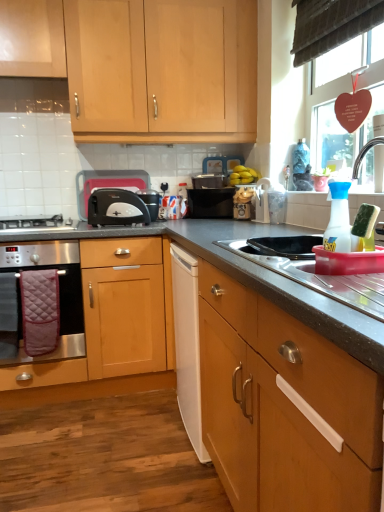
What is the approximate height of yellow matte bananas at upper center?

The height of yellow matte bananas at upper center is 4.70 inches.

Describe the element at coordinates (320, 279) in the screenshot. The height and width of the screenshot is (512, 384). I see `stainless steel sink at lower right` at that location.

Describe the element at coordinates (40, 310) in the screenshot. The height and width of the screenshot is (512, 384). I see `pink quilted oven mitt at lower left` at that location.

You are a GUI agent. You are given a task and a screenshot of the screen. Output one action in this format:
    pyautogui.click(x=<x>, y=<y>)
    Task: Click on the white plastic sponge at right, marked as the first appliance in a front-to-back arrangement
    The height and width of the screenshot is (512, 384).
    Given the screenshot: What is the action you would take?
    pyautogui.click(x=364, y=228)

Are silver metallic faucet at upper right and light wood/finish cabinet at upper left, which is counted as the first cabinetry, starting from the back, located far from each other?

Yes, silver metallic faucet at upper right and light wood/finish cabinet at upper left, which is counted as the first cabinetry, starting from the back, are quite far apart.

Measure the distance from silver metallic faucet at upper right to light wood/finish cabinet at upper left, which is counted as the first cabinetry, starting from the back.

A distance of 3.98 feet exists between silver metallic faucet at upper right and light wood/finish cabinet at upper left, which is counted as the first cabinetry, starting from the back.

Does silver metallic faucet at upper right have a greater width compared to light wood/finish cabinet at upper left, which is counted as the first cabinetry, starting from the back?

In fact, silver metallic faucet at upper right might be narrower than light wood/finish cabinet at upper left, which is counted as the first cabinetry, starting from the back.

From the image's perspective, is silver metallic faucet at upper right beneath light wood/finish cabinet at upper left, placed as the 1th cabinetry when sorted from top to bottom?

Indeed, from the image's perspective, silver metallic faucet at upper right is shown beneath light wood/finish cabinet at upper left, placed as the 1th cabinetry when sorted from top to bottom.

Considering the relative sizes of white plastic container at upper center, the 3th appliance positioned from the front, and pink quilted oven mitt at lower left in the image provided, is white plastic container at upper center, the 3th appliance positioned from the front, thinner than pink quilted oven mitt at lower left?

No.

Which is correct: white plastic container at upper center, arranged as the third appliance when viewed from the back, is inside pink quilted oven mitt at lower left, or outside of it?

white plastic container at upper center, arranged as the third appliance when viewed from the back, exists outside the volume of pink quilted oven mitt at lower left.

Is white plastic container at upper center, arranged as the third appliance when viewed from the back, positioned with its back to pink quilted oven mitt at lower left?

No, white plastic container at upper center, arranged as the third appliance when viewed from the back,'s orientation is not away from pink quilted oven mitt at lower left.

Is dark gray laminate countertop at center not within transparent plastic spray bottle at right, placed as the 2th appliance when sorted from front to back?

Absolutely, dark gray laminate countertop at center is external to transparent plastic spray bottle at right, placed as the 2th appliance when sorted from front to back.

Which object is positioned more to the right, dark gray laminate countertop at center or transparent plastic spray bottle at right, placed as the 2th appliance when sorted from front to back?

From the viewer's perspective, transparent plastic spray bottle at right, placed as the 2th appliance when sorted from front to back, appears more on the right side.

Can you confirm if dark gray laminate countertop at center is smaller than transparent plastic spray bottle at right, placed as the 2th appliance when sorted from front to back?

No, dark gray laminate countertop at center is not smaller than transparent plastic spray bottle at right, placed as the 2th appliance when sorted from front to back.

From a real-world perspective, is dark gray laminate countertop at center under transparent plastic spray bottle at right, placed as the 2th appliance when sorted from front to back?

Yes.

Is white plastic toaster at center-left not within stainless steel sink at lower right?

Absolutely, white plastic toaster at center-left is external to stainless steel sink at lower right.

Considering the sizes of objects white plastic toaster at center-left and stainless steel sink at lower right in the image provided, who is shorter, white plastic toaster at center-left or stainless steel sink at lower right?

stainless steel sink at lower right is shorter.

Between white plastic toaster at center-left and stainless steel sink at lower right, which one has smaller width?

white plastic toaster at center-left.

Is point (102, 179) closer or farther from the camera than point (377, 285)?

Point (102, 179) appears to be farther away from the viewer than point (377, 285).

From a real-world perspective, between white plastic container at upper center, arranged as the third appliance when viewed from the back, and white plastic toaster at center-left, who is vertically lower?

From a 3D spatial view, white plastic container at upper center, arranged as the third appliance when viewed from the back, is below.

Based on the photo, can you confirm if white plastic container at upper center, arranged as the third appliance when viewed from the back, is positioned to the left of white plastic toaster at center-left?

No.

Is white plastic container at upper center, the 3th appliance positioned from the front, not within white plastic toaster at center-left?

Yes, white plastic container at upper center, the 3th appliance positioned from the front, is located beyond the bounds of white plastic toaster at center-left.

Between white plastic container at upper center, arranged as the third appliance when viewed from the back, and white plastic toaster at center-left, which one is positioned behind?

Positioned behind is white plastic toaster at center-left.

Based on their positions, is satin silver gas stove at lower left located to the left or right of stainless steel oven at lower left?

Clearly, satin silver gas stove at lower left is on the right of stainless steel oven at lower left in the image.

In terms of height, does satin silver gas stove at lower left look taller or shorter compared to stainless steel oven at lower left?

Considering their sizes, satin silver gas stove at lower left has less height than stainless steel oven at lower left.

Is point (74, 225) less distant than point (47, 260)?

No, (74, 225) is further to viewer.

From a real-world perspective, is satin silver gas stove at lower left physically located above or below stainless steel oven at lower left?

In terms of real-world spatial position, satin silver gas stove at lower left is above stainless steel oven at lower left.

Locate an element on the screen. This screenshot has width=384, height=512. material below the silver metallic faucet at upper right (from the image's perspective) is located at coordinates (40, 310).

From a real-world perspective, does pink quilted oven mitt at lower left stand above silver metallic faucet at upper right?

No, from a real-world perspective, pink quilted oven mitt at lower left is not on top of silver metallic faucet at upper right.

Which object is wider, pink quilted oven mitt at lower left or silver metallic faucet at upper right?

silver metallic faucet at upper right is wider.

Identify the location of cabinetry behind the silver metallic faucet at upper right. This screenshot has width=384, height=512. (142, 64).

You are a GUI agent. You are given a task and a screenshot of the screen. Output one action in this format:
    pyautogui.click(x=<x>, y=<y>)
    Task: Click on the material located below the white plastic container at upper center, arranged as the third appliance when viewed from the back (from the image's perspective)
    This screenshot has width=384, height=512.
    Given the screenshot: What is the action you would take?
    [x=40, y=310]

From the image, which object appears to be nearer to brown fabric exhaust hood at upper center, light wood/finish cabinet at upper left, which is counted as the first cabinetry, starting from the back, or white plastic sponge at right, which ranks as the fifth appliance in back-to-front order?

The object closer to brown fabric exhaust hood at upper center is light wood/finish cabinet at upper left, which is counted as the first cabinetry, starting from the back.

Which object lies nearer to the anchor point pink quilted oven mitt at lower left, yellow matte bananas at upper center or white plastic sponge at right, which ranks as the fifth appliance in back-to-front order?

yellow matte bananas at upper center lies closer to pink quilted oven mitt at lower left than the other object.

When comparing their distances from wooden cabinet at lower right, which appears as the first cabinetry when viewed from the front, does dark gray laminate countertop at center or matte plastic jar at center, marked as the fourth appliance in a front-to-back arrangement, seem closer?

dark gray laminate countertop at center.

Looking at the image, which one is located further to white plastic toaster at center-left, stainless steel oven at lower left or dark gray laminate countertop at center?

The object further to white plastic toaster at center-left is dark gray laminate countertop at center.

From the image, which object appears to be farther from matte plastic jar at center, arranged as the 2th appliance when viewed from the back, light wood/finish cabinet at upper left, the 2th cabinetry when ordered from bottom to top, or white plastic toaster at center-left?

light wood/finish cabinet at upper left, the 2th cabinetry when ordered from bottom to top.

When comparing their distances from pink quilted oven mitt at lower left, does stainless steel oven at lower left or silver metallic faucet at upper right seem closer?

stainless steel oven at lower left is positioned closer to the anchor pink quilted oven mitt at lower left.

Estimate the real-world distances between objects in this image. Which object is closer to transparent plastic spray bottle at right, the 4th appliance in the back-to-front sequence, wooden cabinet at lower right, the second cabinetry positioned from the top, or pink quilted oven mitt at lower left?

Based on the image, wooden cabinet at lower right, the second cabinetry positioned from the top, appears to be nearer to transparent plastic spray bottle at right, the 4th appliance in the back-to-front sequence.

Estimate the real-world distances between objects in this image. Which object is further from satin silver gas stove at lower left, matte plastic jar at center, arranged as the 2th appliance when viewed from the back, or brown fabric exhaust hood at upper center?

The object further to satin silver gas stove at lower left is brown fabric exhaust hood at upper center.

The width and height of the screenshot is (384, 512). I want to click on gas stove between stainless steel sink at lower right and matte plastic jar at center, marked as the fourth appliance in a front-to-back arrangement, along the z-axis, so click(37, 222).

Locate an element on the screen. Image resolution: width=384 pixels, height=512 pixels. material between stainless steel oven at lower left and white plastic container at upper center, the 3th appliance positioned from the front is located at coordinates (40, 310).

Identify the location of home appliance positioned between wooden cabinet at lower right, the 2th cabinetry viewed from the back, and satin silver gas stove at lower left from near to far. pyautogui.click(x=59, y=297).

You are a GUI agent. You are given a task and a screenshot of the screen. Output one action in this format:
    pyautogui.click(x=<x>, y=<y>)
    Task: Click on the appliance between satin silver gas stove at lower left and yellow matte bananas at upper center
    This screenshot has width=384, height=512.
    Given the screenshot: What is the action you would take?
    pyautogui.click(x=211, y=202)